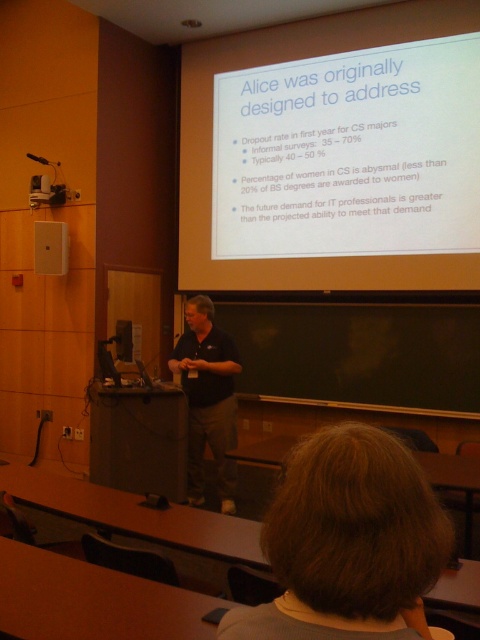
You are a student sitting in the front row of the classroom. You want to see both the white matte projector screen at upper center and the brown hair at upper center clearly. Which one is located higher in the image?

The white matte projector screen at upper center is positioned over brown hair at upper center, so it is higher in the image.

Consider the image. You are an attendee in the classroom and want to see both the point at coordinates point (399, 161) and the point at coordinates point (200, 490) on the projection screen. Which point will appear closer to you?

Point (399, 161) is further to the viewer than point (200, 490), so the point at coordinates point (399, 161) will appear closer to you.